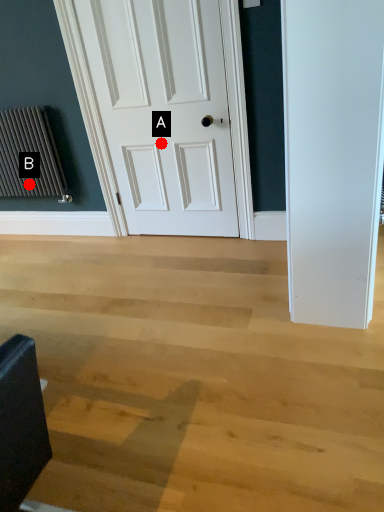
Question: Two points are circled on the image, labeled by A and B beside each circle. Among these points, which one is farthest from the camera?

Choices:
 (A) A is further
 (B) B is further

Answer: (B)